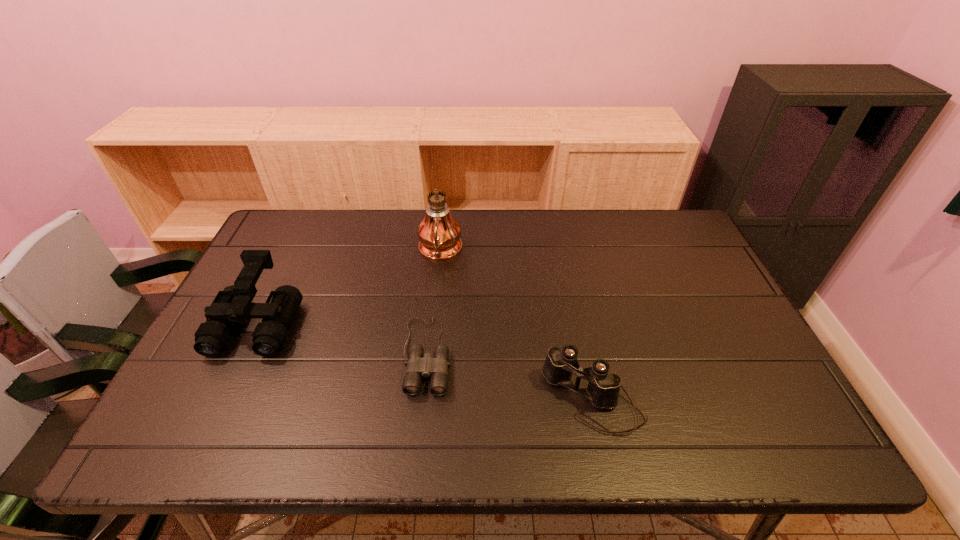
Find the location of a particular element. The width and height of the screenshot is (960, 540). free region located 0.170m on the back of the third tallest object is located at coordinates (575, 316).

Find the location of a particular element. This screenshot has height=540, width=960. free space located 0.090m at the eyepiece of the second binoculars from right to left is located at coordinates (419, 433).

This screenshot has width=960, height=540. In order to click on object positioned at the far edge in this screenshot , I will do `click(439, 233)`.

At what (x,y) coordinates should I click in order to perform the action: click on object present at the near edge. Please return your answer as a coordinate pair (x, y). The width and height of the screenshot is (960, 540). Looking at the image, I should click on (603, 388).

Where is `object at the left edge`? The width and height of the screenshot is (960, 540). object at the left edge is located at coordinates tap(232, 305).

In the image, there is a desktop. Identify the location of vacant space at the far edge. (587, 209).

Identify the location of free space at the near edge of the desktop. The image size is (960, 540). (515, 427).

You are a GUI agent. You are given a task and a screenshot of the screen. Output one action in this format:
    pyautogui.click(x=<x>, y=<y>)
    Task: Click on the free space at the left edge of the desktop
    The width and height of the screenshot is (960, 540).
    Given the screenshot: What is the action you would take?
    pyautogui.click(x=291, y=272)

This screenshot has height=540, width=960. Find the location of `free space at the right edge of the desktop`. free space at the right edge of the desktop is located at coordinates tap(745, 372).

Where is `free location at the near right corner`? free location at the near right corner is located at coordinates (765, 419).